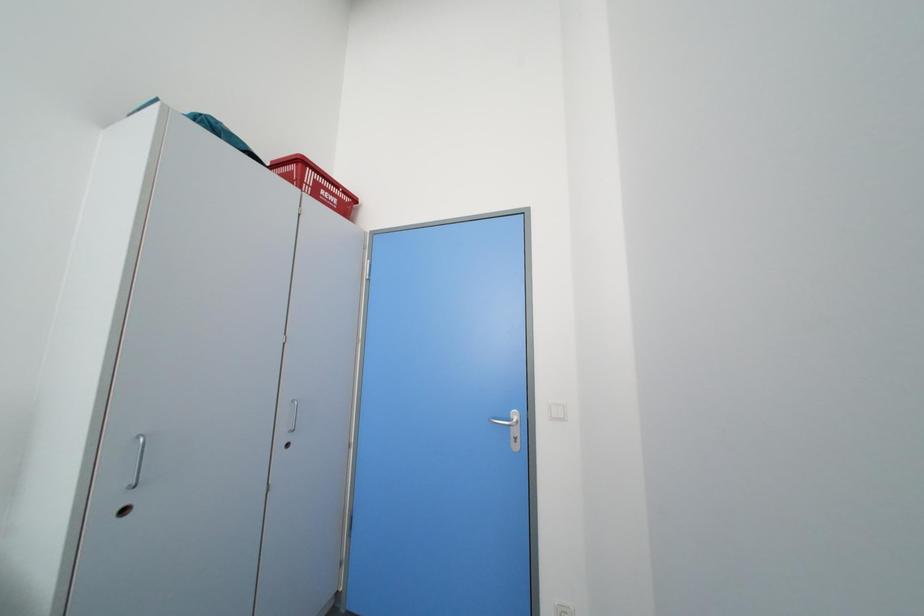
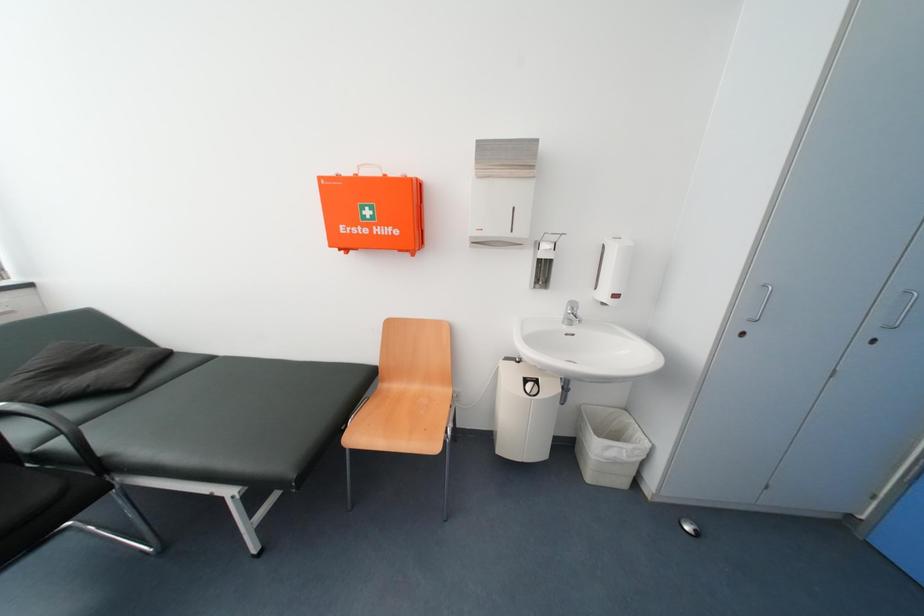
First-person continuous shooting, in which direction is the camera rotating?

The rotation direction of the camera is left-down.